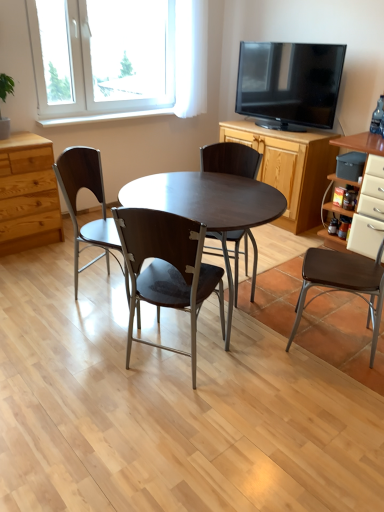
Question: Is matte brown chair at center, marked as the 2th chair in a left-to-right arrangement, outside matte brown chair at left, which is the first chair from left to right?

Choices:
 (A) yes
 (B) no

Answer: (A)

Question: Is matte brown chair at center, which is counted as the third chair, starting from the right, beside matte brown chair at left, acting as the 4th chair starting from the right?

Choices:
 (A) no
 (B) yes

Answer: (A)

Question: Can you confirm if matte brown chair at center, marked as the 2th chair in a left-to-right arrangement, is bigger than matte brown chair at left, acting as the 4th chair starting from the right?

Choices:
 (A) no
 (B) yes

Answer: (A)

Question: Is matte brown chair at center, which is counted as the third chair, starting from the right, taller than matte brown chair at left, acting as the 4th chair starting from the right?

Choices:
 (A) no
 (B) yes

Answer: (A)

Question: From the image's perspective, relative to brown leather chair at right, the first chair from the right, is matte dark wood table at center above or below?

Choices:
 (A) below
 (B) above

Answer: (B)

Question: Is matte dark wood table at center inside or outside of brown leather chair at right, the fourth chair from the left?

Choices:
 (A) outside
 (B) inside

Answer: (A)

Question: From a real-world perspective, is matte dark wood table at center above or below brown leather chair at right, the first chair from the right?

Choices:
 (A) below
 (B) above

Answer: (A)

Question: In terms of height, does matte dark wood table at center look taller or shorter compared to brown leather chair at right, the fourth chair from the left?

Choices:
 (A) short
 (B) tall

Answer: (A)

Question: Considering the positions of matte brown chair at left, which is the first chair from left to right, and matte dark wood table at center in the image, is matte brown chair at left, which is the first chair from left to right, bigger or smaller than matte dark wood table at center?

Choices:
 (A) small
 (B) big

Answer: (A)

Question: Considering the positions of point (84, 231) and point (208, 215), is point (84, 231) closer or farther from the camera than point (208, 215)?

Choices:
 (A) closer
 (B) farther

Answer: (B)

Question: From the image's perspective, is matte brown chair at left, acting as the 4th chair starting from the right, positioned above or below matte dark wood table at center?

Choices:
 (A) below
 (B) above

Answer: (B)

Question: Looking at their shapes, would you say matte brown chair at left, acting as the 4th chair starting from the right, is wider or thinner than matte dark wood table at center?

Choices:
 (A) wide
 (B) thin

Answer: (B)

Question: In terms of height, does white glossy cabinet at right, positioned as the first cabinetry in right-to-left order, look taller or shorter compared to wooden cabinet at center right, which appears as the first cabinetry when viewed from the left?

Choices:
 (A) tall
 (B) short

Answer: (A)

Question: Looking at the image, does white glossy cabinet at right, marked as the second cabinetry in a left-to-right arrangement, seem bigger or smaller compared to wooden cabinet at center right, marked as the 2th cabinetry in a right-to-left arrangement?

Choices:
 (A) small
 (B) big

Answer: (A)